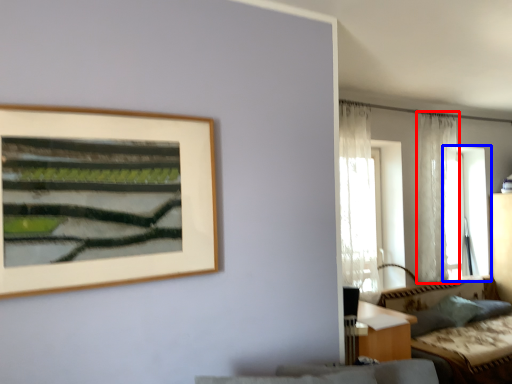
Question: Among these objects, which one is farthest to the camera, curtain (highlighted by a red box) or window (highlighted by a blue box)?

Choices:
 (A) curtain
 (B) window

Answer: (B)